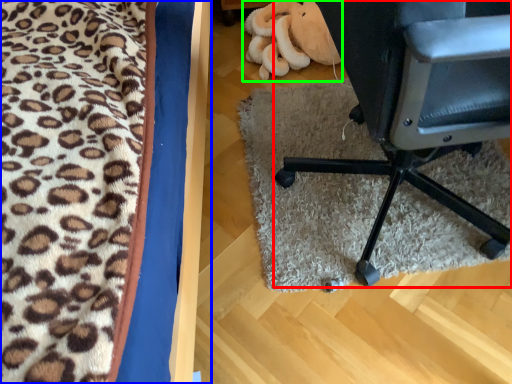
Question: Based on their relative distances, which object is farther from chair (highlighted by a red box)? Choose from furniture (highlighted by a blue box) and stuff (highlighted by a green box).

Choices:
 (A) furniture
 (B) stuff

Answer: (B)